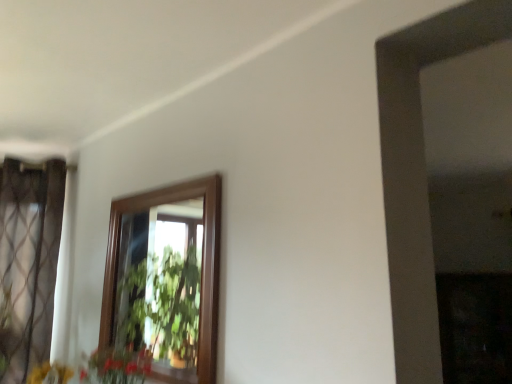
Question: Should I look upward or downward to see brown sheer curtain at left?

Choices:
 (A) down
 (B) up

Answer: (A)